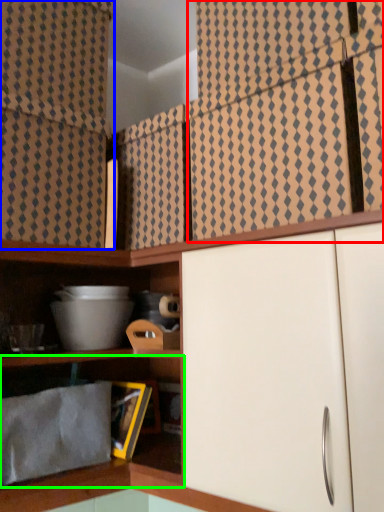
Question: Based on their relative distances, which object is nearer to curtain (highlighted by a red box)? Choose from curtain (highlighted by a blue box) and shelf (highlighted by a green box).

Choices:
 (A) curtain
 (B) shelf

Answer: (A)